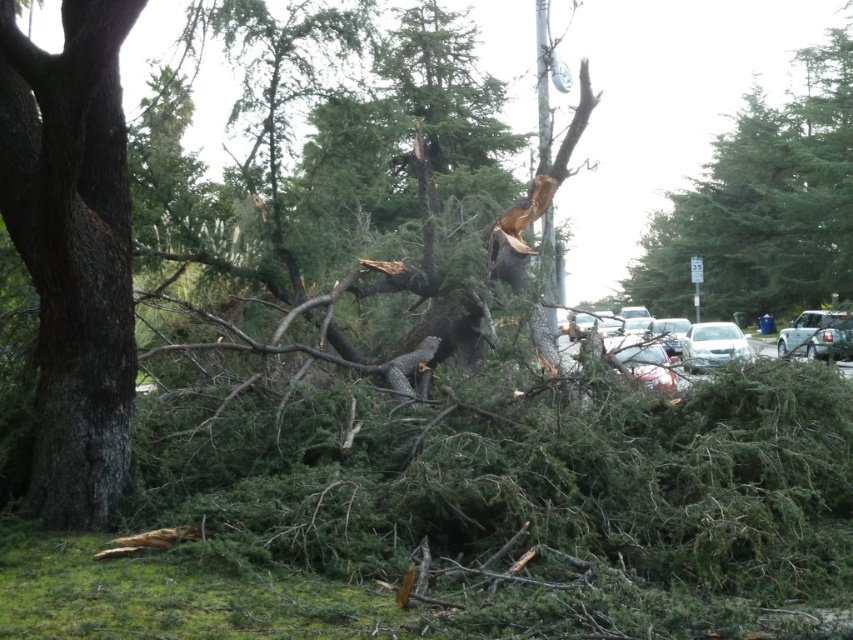
You are a tow truck driver who needs to tow both the green matte car at right and the white matte car at center from the scene of the storm. Given that your tow truck can only tow vehicles smaller than 5 meters in length, can you tow both cars without needing additional assistance?

The green matte car at right is larger in size than the white matte car at center. Since the tow truck can only tow vehicles smaller than 5 meters, if the white matte car at center is under 5 meters, it can be towed. However, the green matte car at right, being larger, might exceed the 5 meter limit and require additional assistance.

You are a delivery person who needs to deliver a package to the white matte car at center. The smooth brown tree trunk at left is blocking the path. Can you walk around the tree to reach the car?

The smooth brown tree trunk at left and the white matte car at center are 6.86 meters apart. Since the tree is blocking the path, you can walk around it to reach the car as there is enough space between them.

You are a delivery driver who needs to park your car in this area. You see the green matte car at right and the white matte car at center. Which car is positioned higher up in the image?

The green matte car at right is above the white matte car at center, so it is positioned higher up in the image.